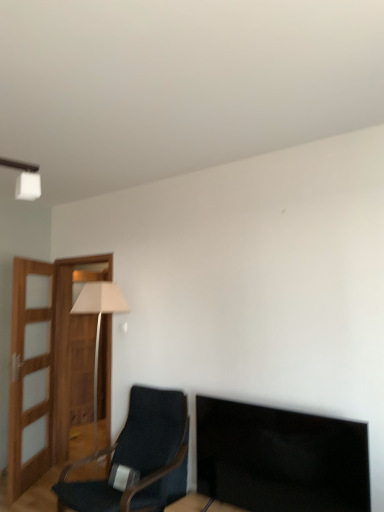
Locate an element on the screen. matte beige lamp at left is located at coordinates (99, 319).

Describe the element at coordinates (99, 319) in the screenshot. I see `matte beige lamp at left` at that location.

Find the location of a particular element. Image resolution: width=384 pixels, height=512 pixels. dark blue fabric chair at lower left is located at coordinates (136, 456).

This screenshot has height=512, width=384. What do you see at coordinates (136, 456) in the screenshot? I see `dark blue fabric chair at lower left` at bounding box center [136, 456].

Locate an element on the screen. The image size is (384, 512). matte beige lamp at left is located at coordinates (99, 319).

Which object is positioned more to the right, dark blue fabric chair at lower left or matte beige lamp at left?

dark blue fabric chair at lower left is more to the right.

Which object is closer to the camera, dark blue fabric chair at lower left or matte beige lamp at left?

dark blue fabric chair at lower left is in front.

Considering the points (142, 392) and (92, 298), which point is in front, point (142, 392) or point (92, 298)?

Positioned in front is point (142, 392).

From the image's perspective, which is below, dark blue fabric chair at lower left or matte beige lamp at left?

dark blue fabric chair at lower left appears lower in the image.

From a real-world perspective, is dark blue fabric chair at lower left above or below matte beige lamp at left?

dark blue fabric chair at lower left is situated lower than matte beige lamp at left in the real world.

Between dark blue fabric chair at lower left and matte beige lamp at left, which one has smaller width?

matte beige lamp at left is thinner.

Is dark blue fabric chair at lower left taller or shorter than matte beige lamp at left?

dark blue fabric chair at lower left is shorter than matte beige lamp at left.

From the picture: Is dark blue fabric chair at lower left bigger or smaller than matte beige lamp at left?

Considering their sizes, dark blue fabric chair at lower left takes up more space than matte beige lamp at left.

Do you think dark blue fabric chair at lower left is within matte beige lamp at left, or outside of it?

dark blue fabric chair at lower left is outside matte beige lamp at left.

Is dark blue fabric chair at lower left placed right next to matte beige lamp at left?

No, dark blue fabric chair at lower left is not making contact with matte beige lamp at left.

Is dark blue fabric chair at lower left aimed at matte beige lamp at left?

No, dark blue fabric chair at lower left is not turned towards matte beige lamp at left.

What's the angular difference between dark blue fabric chair at lower left and matte beige lamp at left's facing directions?

0.113 degrees separate the facing orientations of dark blue fabric chair at lower left and matte beige lamp at left.

Locate an element on the screen. This screenshot has width=384, height=512. table lamp behind the dark blue fabric chair at lower left is located at coordinates (99, 319).

Considering the relative positions of matte beige lamp at left and dark blue fabric chair at lower left in the image provided, is matte beige lamp at left to the left of dark blue fabric chair at lower left from the viewer's perspective?

Correct, you'll find matte beige lamp at left to the left of dark blue fabric chair at lower left.

Is matte beige lamp at left behind dark blue fabric chair at lower left?

Yes, matte beige lamp at left is further from the camera.

Does point (96, 305) appear closer or farther from the camera than point (89, 498)?

Point (96, 305).

From the image's perspective, is matte beige lamp at left above or below dark blue fabric chair at lower left?

matte beige lamp at left is situated higher than dark blue fabric chair at lower left in the image.

From a real-world perspective, is matte beige lamp at left positioned under dark blue fabric chair at lower left based on gravity?

No, from a real-world perspective, matte beige lamp at left is not below dark blue fabric chair at lower left.

From the picture: Which object is thinner, matte beige lamp at left or dark blue fabric chair at lower left?

Thinner between the two is matte beige lamp at left.

Is matte beige lamp at left shorter than dark blue fabric chair at lower left?

No.

In terms of size, does matte beige lamp at left appear bigger or smaller than dark blue fabric chair at lower left?

matte beige lamp at left is smaller than dark blue fabric chair at lower left.

Would you say matte beige lamp at left contains dark blue fabric chair at lower left?

No, dark blue fabric chair at lower left is not inside matte beige lamp at left.

Is matte beige lamp at left not close to dark blue fabric chair at lower left?

Yes.

Based on the photo, is matte beige lamp at left aimed at dark blue fabric chair at lower left?

No, matte beige lamp at left is not facing towards dark blue fabric chair at lower left.

Can you tell me how much matte beige lamp at left and dark blue fabric chair at lower left differ in facing direction?

The angular difference between matte beige lamp at left and dark blue fabric chair at lower left is 0.113 degrees.

How far apart are matte beige lamp at left and dark blue fabric chair at lower left?

A distance of 3.67 feet exists between matte beige lamp at left and dark blue fabric chair at lower left.

This screenshot has width=384, height=512. In order to click on table lamp above the dark blue fabric chair at lower left (from a real-world perspective) in this screenshot , I will do `click(99, 319)`.

Where is `table lamp on the left of the dark blue fabric chair at lower left`? The width and height of the screenshot is (384, 512). table lamp on the left of the dark blue fabric chair at lower left is located at coordinates (99, 319).

Find the location of a particular element. This screenshot has height=512, width=384. chair on the right of the matte beige lamp at left is located at coordinates (136, 456).